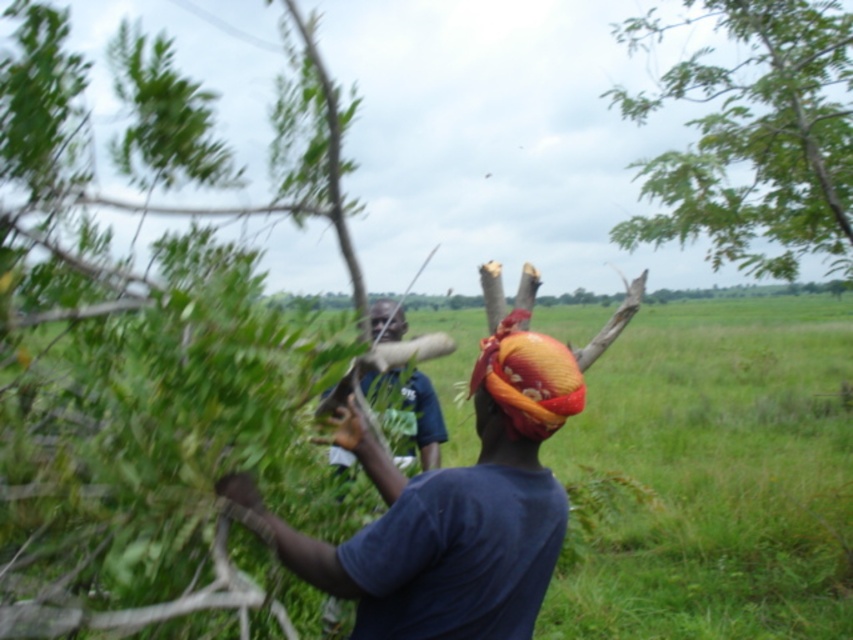
You are a photographer trying to capture a clear shot of the orange fabric headscarf at center and the matte blue shirt at center. Based on their heights, which object should you focus on first if you want to ensure both are in frame without adjusting your camera angle?

The orange fabric headscarf at center is taller than the matte blue shirt at center, so you should focus on the orange fabric headscarf at center first to ensure both are in frame without adjusting your camera angle.

You are a drone operator trying to capture a photo of the matte blue shirt at center and the orange fabric headscarf at center. From the perspective of someone looking at the scene, which object is positioned to the right?

The orange fabric headscarf at center is to the right of the matte blue shirt at center.